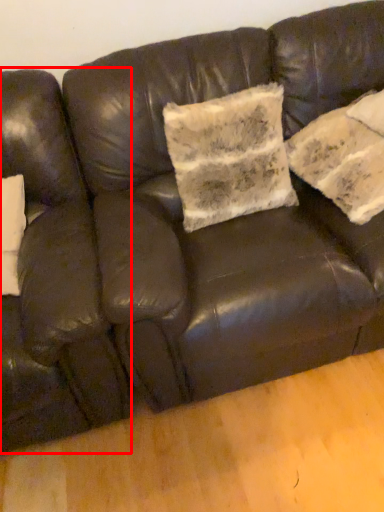
Question: Where is armchair (annotated by the red box) located in relation to pillow in the image?

Choices:
 (A) right
 (B) left

Answer: (B)